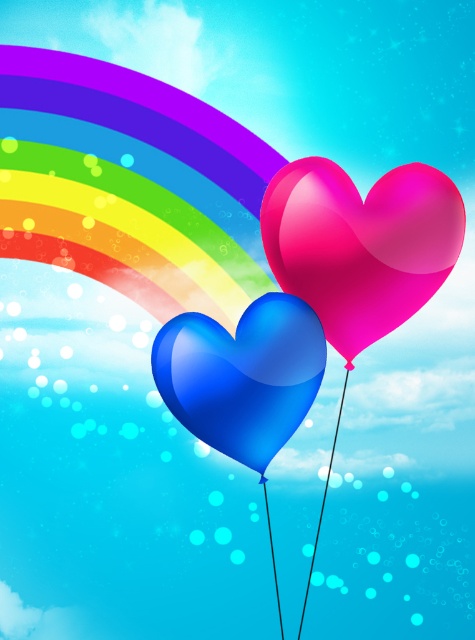
Question: Does glossy pink heart at center have a greater width compared to glossy blue heart at center?

Choices:
 (A) no
 (B) yes

Answer: (B)

Question: Which point appears farthest from the camera in this image?

Choices:
 (A) (330, 252)
 (B) (276, 300)

Answer: (B)

Question: Which object is closer to the camera taking this photo?

Choices:
 (A) glossy blue heart at center
 (B) glossy pink heart at center

Answer: (A)

Question: Which point is farther from the camera taking this photo?

Choices:
 (A) (159, 360)
 (B) (279, 173)

Answer: (B)

Question: Is glossy pink heart at center thinner than glossy blue heart at center?

Choices:
 (A) no
 (B) yes

Answer: (A)

Question: Is glossy pink heart at center positioned behind glossy blue heart at center?

Choices:
 (A) no
 (B) yes

Answer: (B)